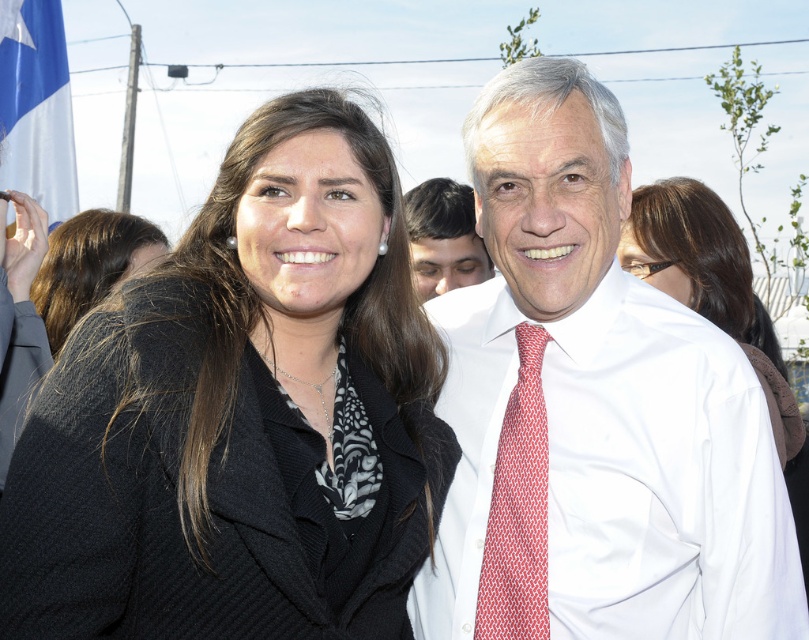
You are a photographer trying to capture a clear shot of both the black silk coat at upper center and the smooth skin face at center. Based on their positions, which object should you focus on first to ensure both are in frame?

The black silk coat at upper center is taller than the smooth skin face at center, so you should focus on the black silk coat at upper center first to ensure both are in frame.

You are a photographer at this event and need to ensure both the white smooth shirt at center and the black silk coat at upper center are fully visible in the frame. Based on their widths, which one might require more careful positioning to avoid being cut off?

The white smooth shirt at center might be wider than black silk coat at upper center, so it might require more careful positioning to avoid being cut off.

You are a photographer at the event and need to adjust your camera focus. Which object is positioned to the right of the other between the white smooth shirt at center and the red woven tie at center?

The white smooth shirt at center is to the right of the red woven tie at center.